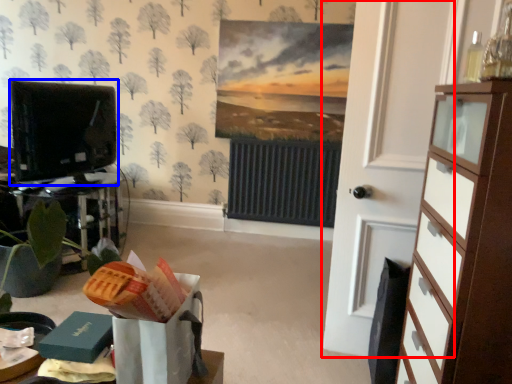
Question: Which of the following is the farthest to the observer, door (highlighted by a red box) or electronic (highlighted by a blue box)?

Choices:
 (A) door
 (B) electronic

Answer: (B)